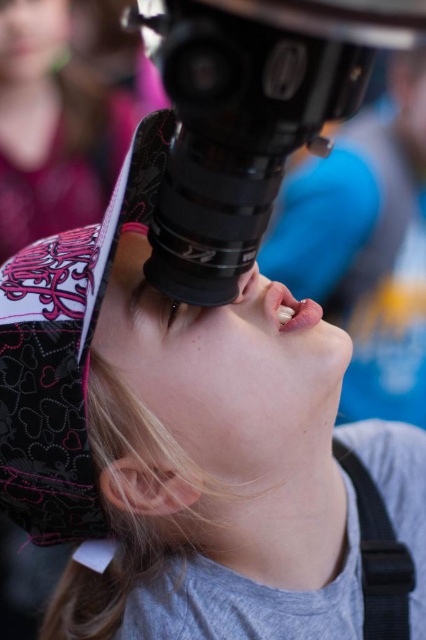
Is black matte telescope at center to the left of matte black eye at center from the viewer's perspective?

Incorrect, black matte telescope at center is not on the left side of matte black eye at center.

Is black matte telescope at center wider than matte black eye at center?

Indeed, black matte telescope at center has a greater width compared to matte black eye at center.

Which is in front, point (218, 291) or point (167, 310)?

Positioned in front is point (218, 291).

The image size is (426, 640). Find the location of `black matte telescope at center`. black matte telescope at center is located at coordinates pos(249,116).